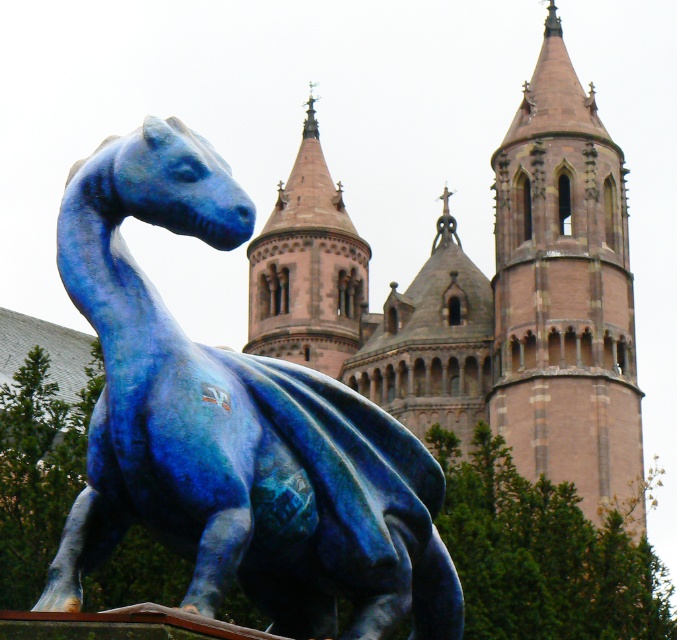
Question: Does brown stone tower at upper center have a lesser width compared to brown stone tower at center?

Choices:
 (A) yes
 (B) no

Answer: (A)

Question: Which point is closer to the camera?

Choices:
 (A) (87, 285)
 (B) (303, 234)
 (C) (502, 403)

Answer: (A)

Question: Where is brown stone tower at upper center located in relation to brown stone tower at center in the image?

Choices:
 (A) above
 (B) below

Answer: (B)

Question: Which point is closer to the camera?

Choices:
 (A) (95, 241)
 (B) (609, 252)

Answer: (A)

Question: From the image, what is the correct spatial relationship of blue glossy dragon at left in relation to brown stone tower at upper center?

Choices:
 (A) above
 (B) below

Answer: (B)

Question: Among these objects, which one is nearest to the camera?

Choices:
 (A) blue glossy dragon at left
 (B) brown stone tower at upper center
 (C) brown stone tower at center

Answer: (A)